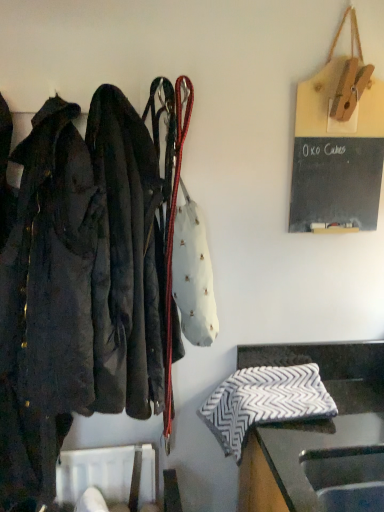
The height and width of the screenshot is (512, 384). What do you see at coordinates (264, 402) in the screenshot? I see `gray and white zigzag-patterned cloth at lower right` at bounding box center [264, 402].

What do you see at coordinates (188, 247) in the screenshot? The image size is (384, 512). I see `white leather handbag at center` at bounding box center [188, 247].

Image resolution: width=384 pixels, height=512 pixels. Identify the location of black and white zigzag-patterned cloth at lower right. (310, 421).

Locate an element on the screen. The width and height of the screenshot is (384, 512). dark brown leather jacket at left is located at coordinates (125, 260).

Is white leather handbag at center looking in the opposite direction of dark brown leather jacket at left?

No, white leather handbag at center is not facing the opposite direction of dark brown leather jacket at left.

The height and width of the screenshot is (512, 384). Find the location of `handbag that is above the dark brown leather jacket at left (from a real-world perspective)`. handbag that is above the dark brown leather jacket at left (from a real-world perspective) is located at coordinates (188, 247).

From the image's perspective, does white leather handbag at center appear higher than dark brown leather jacket at left?

Indeed, from the image's perspective, white leather handbag at center is shown above dark brown leather jacket at left.

Between white leather handbag at center and dark brown leather jacket at left, which one appears on the left side from the viewer's perspective?

From the viewer's perspective, dark brown leather jacket at left appears more on the left side.

In the scene shown: Is black plastic sink at lower right far from gray and white zigzag-patterned cloth at lower right?

No, black plastic sink at lower right is in close proximity to gray and white zigzag-patterned cloth at lower right.

Considering the relative sizes of black plastic sink at lower right and gray and white zigzag-patterned cloth at lower right in the image provided, is black plastic sink at lower right thinner than gray and white zigzag-patterned cloth at lower right?

Indeed, black plastic sink at lower right has a lesser width compared to gray and white zigzag-patterned cloth at lower right.

From the image's perspective, between black plastic sink at lower right and gray and white zigzag-patterned cloth at lower right, which one is located above?

From the image's view, gray and white zigzag-patterned cloth at lower right is above.

From their relative heights in the image, would you say black plastic sink at lower right is taller or shorter than gray and white zigzag-patterned cloth at lower right?

In the image, black plastic sink at lower right appears to be shorter than gray and white zigzag-patterned cloth at lower right.

Which is behind, black plastic sink at lower right or black and white zigzag-patterned cloth at lower right?

black plastic sink at lower right is further from the camera.

Where is `furniture located on the right of black plastic sink at lower right`? furniture located on the right of black plastic sink at lower right is located at coordinates (310, 421).

From the image's perspective, who appears lower, black plastic sink at lower right or black and white zigzag-patterned cloth at lower right?

black and white zigzag-patterned cloth at lower right appears lower in the image.

Which of these two, white leather handbag at center or wooden clipboard at upper right, is wider?

white leather handbag at center.

Considering the positions of point (201, 310) and point (354, 192), is point (201, 310) closer or farther from the camera than point (354, 192)?

Clearly, point (201, 310) is closer to the camera than point (354, 192).

Which object is positioned more to the right, white leather handbag at center or wooden clipboard at upper right?

From the viewer's perspective, wooden clipboard at upper right appears more on the right side.

Does black and white zigzag-patterned cloth at lower right turn towards black plastic sink at lower right?

Result: Yes, black and white zigzag-patterned cloth at lower right faces towards black plastic sink at lower right.

From a real-world perspective, who is located lower, black and white zigzag-patterned cloth at lower right or black plastic sink at lower right?

From a 3D spatial view, black and white zigzag-patterned cloth at lower right is below.

Which is behind, point (239, 508) or point (379, 510)?

The point (239, 508) is farther.

Does black and white zigzag-patterned cloth at lower right contain black plastic sink at lower right?

Yes, black plastic sink at lower right can be found within black and white zigzag-patterned cloth at lower right.

The width and height of the screenshot is (384, 512). Identify the location of furniture located in front of the white leather handbag at center. (310, 421).

Is black and white zigzag-patterned cloth at lower right far away from white leather handbag at center?

That's not correct — black and white zigzag-patterned cloth at lower right is a little close to white leather handbag at center.

Which of these two, black and white zigzag-patterned cloth at lower right or white leather handbag at center, is thinner?

white leather handbag at center.

Is gray and white zigzag-patterned cloth at lower right wider or thinner than wooden clipboard at upper right?

Clearly, gray and white zigzag-patterned cloth at lower right has more width compared to wooden clipboard at upper right.

From the image's perspective, does gray and white zigzag-patterned cloth at lower right appear lower than wooden clipboard at upper right?

Indeed, from the image's perspective, gray and white zigzag-patterned cloth at lower right is shown beneath wooden clipboard at upper right.

Is gray and white zigzag-patterned cloth at lower right not close to wooden clipboard at upper right?

gray and white zigzag-patterned cloth at lower right is near wooden clipboard at upper right, not far away.

From the picture: From a real-world perspective, is gray and white zigzag-patterned cloth at lower right positioned over wooden clipboard at upper right based on gravity?

No, from a real-world perspective, gray and white zigzag-patterned cloth at lower right is not over wooden clipboard at upper right

Find the location of a particular element. jacket that appears in front of the white leather handbag at center is located at coordinates (125, 260).

You are a GUI agent. You are given a task and a screenshot of the screen. Output one action in this format:
    pyautogui.click(x=<x>, y=<y>)
    Task: Click on the sink that appears below the gray and white zigzag-patterned cloth at lower right (from a real-world perspective)
    The image size is (384, 512).
    Given the screenshot: What is the action you would take?
    pyautogui.click(x=347, y=477)

Estimate the real-world distances between objects in this image. Which object is further from black and white zigzag-patterned cloth at lower right, wooden clipboard at upper right or white leather handbag at center?

wooden clipboard at upper right.

Which object lies further to the anchor point wooden clipboard at upper right, black and white zigzag-patterned cloth at lower right or gray and white zigzag-patterned cloth at lower right?

gray and white zigzag-patterned cloth at lower right is further to wooden clipboard at upper right.

Estimate the real-world distances between objects in this image. Which object is further from gray and white zigzag-patterned cloth at lower right, wooden clipboard at upper right or dark brown leather jacket at left?

The object further to gray and white zigzag-patterned cloth at lower right is wooden clipboard at upper right.

Based on their spatial positions, is black plastic sink at lower right or gray and white zigzag-patterned cloth at lower right further from dark brown leather jacket at left?

The object further to dark brown leather jacket at left is black plastic sink at lower right.

When comparing their distances from dark brown leather jacket at left, does black plastic sink at lower right or wooden clipboard at upper right seem further?

black plastic sink at lower right is further to dark brown leather jacket at left.

From the image, which object appears to be farther from dark brown leather jacket at left, gray and white zigzag-patterned cloth at lower right or black and white zigzag-patterned cloth at lower right?

black and white zigzag-patterned cloth at lower right is further to dark brown leather jacket at left.

Estimate the real-world distances between objects in this image. Which object is closer to gray and white zigzag-patterned cloth at lower right, dark brown leather jacket at left or black and white zigzag-patterned cloth at lower right?

black and white zigzag-patterned cloth at lower right is closer to gray and white zigzag-patterned cloth at lower right.

When comparing their distances from dark brown leather jacket at left, does black plastic sink at lower right or white leather handbag at center seem closer?

Based on the image, white leather handbag at center appears to be nearer to dark brown leather jacket at left.

Locate an element on the screen. The height and width of the screenshot is (512, 384). handbag between wooden clipboard at upper right and gray and white zigzag-patterned cloth at lower right in the vertical direction is located at coordinates (188, 247).

Find the location of a particular element. This screenshot has height=512, width=384. cloth between wooden clipboard at upper right and black and white zigzag-patterned cloth at lower right from top to bottom is located at coordinates (264, 402).

You are a GUI agent. You are given a task and a screenshot of the screen. Output one action in this format:
    pyautogui.click(x=<x>, y=<y>)
    Task: Click on the jacket between wooden clipboard at upper right and gray and white zigzag-patterned cloth at lower right vertically
    This screenshot has width=384, height=512.
    Given the screenshot: What is the action you would take?
    pyautogui.click(x=125, y=260)

The image size is (384, 512). Identify the location of cloth between dark brown leather jacket at left and black plastic sink at lower right in the horizontal direction. (264, 402).